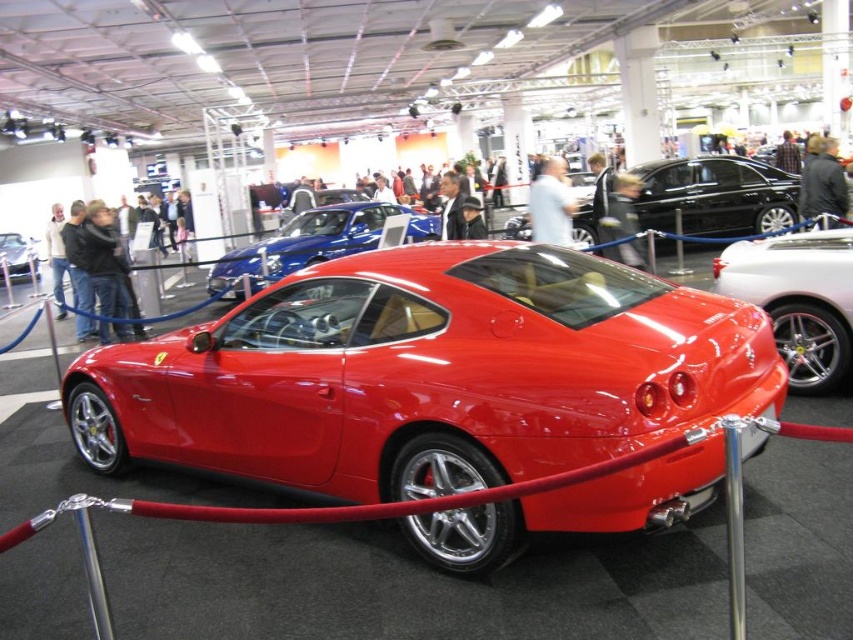
Question: Does glossy white car at right appear on the right side of matte black car at center?

Choices:
 (A) no
 (B) yes

Answer: (B)

Question: Which is nearer to the matte black car at center?

Choices:
 (A) shiny red sports car at center
 (B) glossy white car at right
 (C) glossy metallic car at center

Answer: (C)

Question: Does shiny red sports car at center appear on the left side of shiny red car at center?

Choices:
 (A) yes
 (B) no

Answer: (B)

Question: Which object is positioned closest to the glossy white car at right?

Choices:
 (A) glossy black sedan at center
 (B) glossy metallic car at center

Answer: (A)

Question: Is shiny red sports car at center smaller than glossy black sedan at center?

Choices:
 (A) yes
 (B) no

Answer: (B)

Question: Considering the real-world distances, which object is farthest from the glossy metallic car at center?

Choices:
 (A) glossy black sedan at center
 (B) glossy white car at right

Answer: (B)